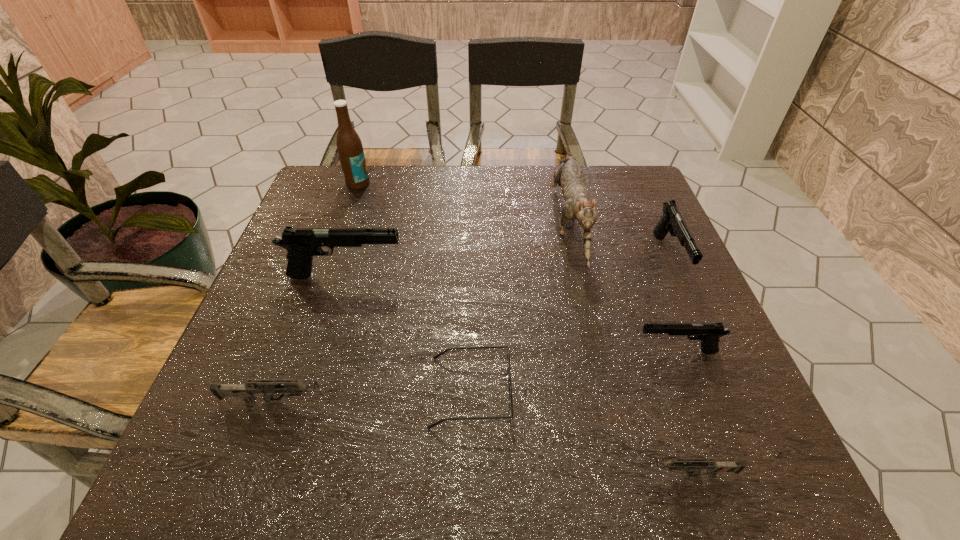
This screenshot has height=540, width=960. Identify the location of vacant region located aimed along the barrel of the bigger grey gun. (469, 401).

Where is `free location located on the front-facing side of the fifth object from right to left`? free location located on the front-facing side of the fifth object from right to left is located at coordinates (681, 392).

Locate an element on the screen. Image resolution: width=960 pixels, height=540 pixels. vacant space situated 0.050m aimed along the barrel of the shortest gun is located at coordinates (603, 474).

Identify the location of vacant space located 0.280m aimed along the barrel of the shortest gun. (459, 474).

This screenshot has height=540, width=960. What are the coordinates of `vacant region located aimed along the barrel of the shortest gun` in the screenshot? It's located at (420, 474).

You are a GUI agent. You are given a task and a screenshot of the screen. Output one action in this format:
    pyautogui.click(x=<x>, y=<y>)
    Task: Click on the beer bottle that is at the far edge
    The height and width of the screenshot is (540, 960).
    Given the screenshot: What is the action you would take?
    pyautogui.click(x=350, y=150)

Where is `cat present at the far edge`? cat present at the far edge is located at coordinates (569, 176).

I want to click on object located in the near edge section of the desktop, so click(x=695, y=465).

In order to click on beer bottle located in the left edge section of the desktop in this screenshot , I will do 350,150.

The image size is (960, 540). I want to click on object present at the far left corner, so click(x=350, y=150).